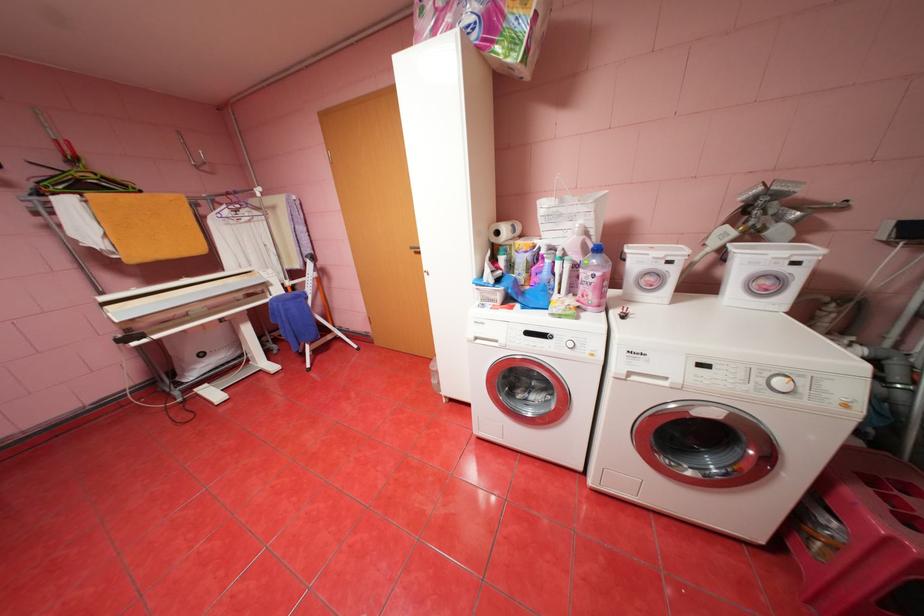
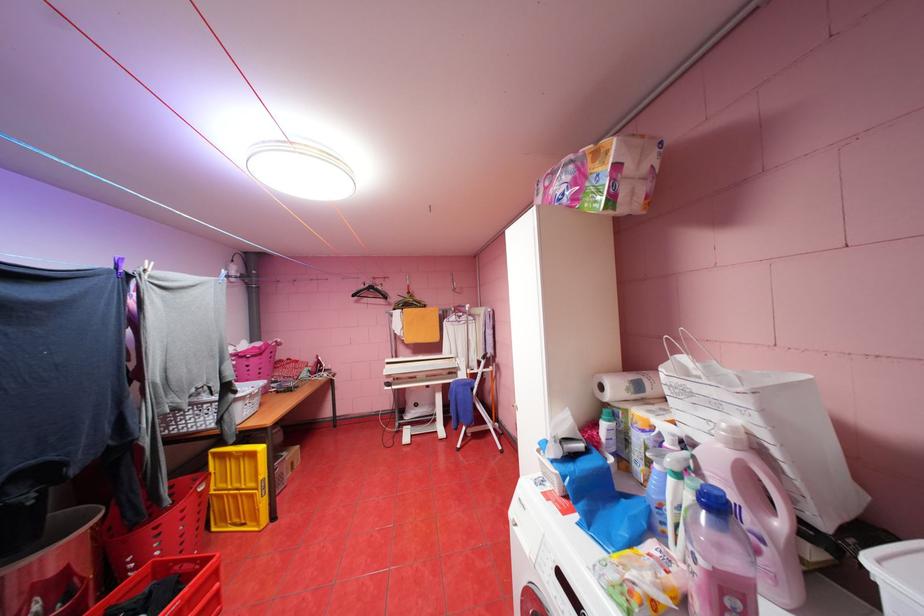
The point at (143, 342) is marked in the first image. Where is the corresponding point in the second image?

(395, 387)